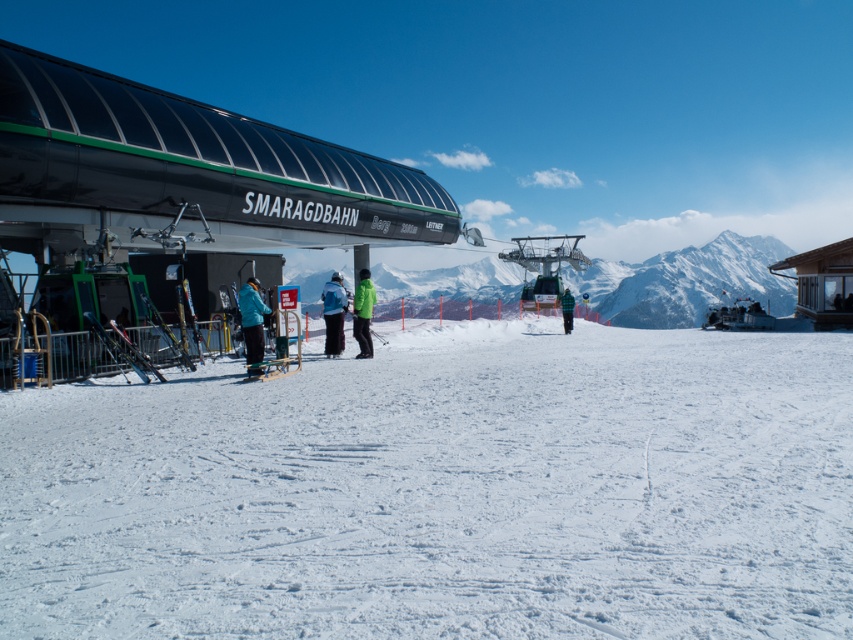
Is the position of blue fabric jacket at center more distant than that of green checkered jacket at center?

No, it is not.

Image resolution: width=853 pixels, height=640 pixels. What are the coordinates of `blue fabric jacket at center` in the screenshot? It's located at (334, 314).

The height and width of the screenshot is (640, 853). Find the location of `blue fabric jacket at center`. blue fabric jacket at center is located at coordinates (334, 314).

Where is `blue fabric jacket at center`? blue fabric jacket at center is located at coordinates (334, 314).

Does white snow at center come behind metallic silver ski at lower left?

No, it is not.

Based on the photo, between white snow at center and metallic silver ski at lower left, which one has more height?

Standing taller between the two is metallic silver ski at lower left.

This screenshot has width=853, height=640. What are the coordinates of `white snow at center` in the screenshot? It's located at (444, 492).

Locate an element on the screen. This screenshot has height=640, width=853. white snow at center is located at coordinates (444, 492).

Who is lower down, metallic silver ski at lower left or green checkered jacket at center?

Positioned lower is metallic silver ski at lower left.

Does point (132, 365) come closer to viewer compared to point (567, 328)?

Yes, it is in front of point (567, 328).

Measure the distance between point [131,349] and camera.

16.02 meters

The height and width of the screenshot is (640, 853). Find the location of `metallic silver ski at lower left`. metallic silver ski at lower left is located at coordinates (119, 348).